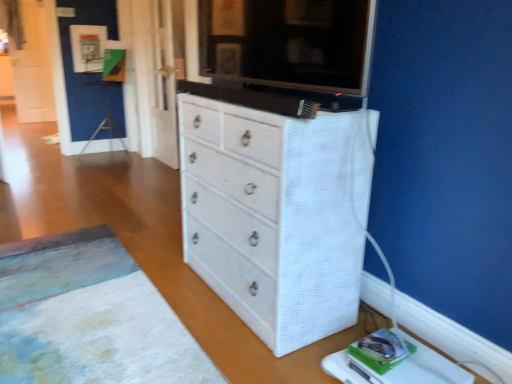
Question: Does white textured rug at lower left appear on the right side of white textured cabinet at upper center?

Choices:
 (A) no
 (B) yes

Answer: (A)

Question: Does white textured rug at lower left have a lesser width compared to white textured cabinet at upper center?

Choices:
 (A) yes
 (B) no

Answer: (B)

Question: Can you confirm if white textured rug at lower left is shorter than white textured cabinet at upper center?

Choices:
 (A) yes
 (B) no

Answer: (A)

Question: Is the depth of white textured rug at lower left greater than that of white textured cabinet at upper center?

Choices:
 (A) no
 (B) yes

Answer: (A)

Question: Does white textured rug at lower left have a smaller size compared to white textured cabinet at upper center?

Choices:
 (A) yes
 (B) no

Answer: (B)

Question: Visually, is white textured changing table at lower right positioned to the left or to the right of white textured rug at lower left?

Choices:
 (A) left
 (B) right

Answer: (B)

Question: Is white textured changing table at lower right taller or shorter than white textured rug at lower left?

Choices:
 (A) tall
 (B) short

Answer: (A)

Question: Looking at their shapes, would you say white textured changing table at lower right is wider or thinner than white textured rug at lower left?

Choices:
 (A) thin
 (B) wide

Answer: (A)

Question: Which is correct: white textured changing table at lower right is inside white textured rug at lower left, or outside of it?

Choices:
 (A) inside
 (B) outside

Answer: (B)

Question: In the image, is white textured chest of drawers at center positioned in front of or behind white textured rug at lower left?

Choices:
 (A) front
 (B) behind

Answer: (B)

Question: Based on their positions, is white textured chest of drawers at center located to the left or right of white textured rug at lower left?

Choices:
 (A) right
 (B) left

Answer: (A)

Question: Considering the positions of white textured chest of drawers at center and white textured rug at lower left in the image, is white textured chest of drawers at center wider or thinner than white textured rug at lower left?

Choices:
 (A) wide
 (B) thin

Answer: (B)

Question: Choose the correct answer: Is white textured chest of drawers at center inside white textured rug at lower left or outside it?

Choices:
 (A) outside
 (B) inside

Answer: (A)

Question: Is point [x=424, y=375] positioned closer to the camera than point [x=355, y=81]?

Choices:
 (A) closer
 (B) farther

Answer: (B)

Question: Is white textured changing table at lower right taller or shorter than white textured cabinet at upper center?

Choices:
 (A) tall
 (B) short

Answer: (B)